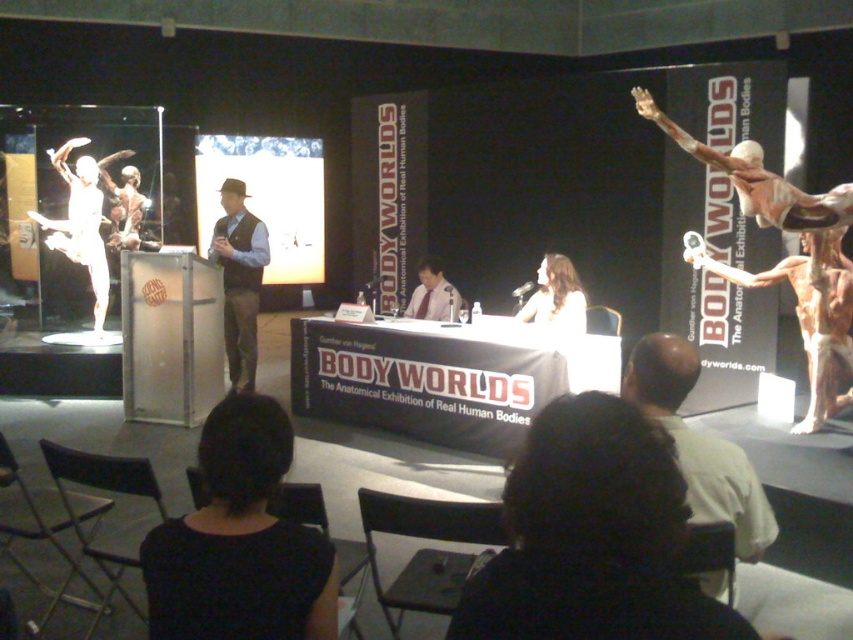
Does black fabric at lower center have a lesser width compared to matte brown vest at center?

Yes.

Who is higher up, black fabric at lower center or matte brown vest at center?

matte brown vest at center

Where is `black fabric at lower center`? The width and height of the screenshot is (853, 640). black fabric at lower center is located at coordinates (241, 541).

Between dark brown hair at lower center and pink fabric tie at center, which one is positioned higher?

pink fabric tie at center is above.

Does dark brown hair at lower center lie behind pink fabric tie at center?

No.

Image resolution: width=853 pixels, height=640 pixels. Find the location of `dark brown hair at lower center`. dark brown hair at lower center is located at coordinates (592, 536).

Where is `dark brown hair at lower center`? This screenshot has width=853, height=640. dark brown hair at lower center is located at coordinates (592, 536).

Looking at this image, how much distance is there between black fabric at lower center and pink fabric tie at center?

The distance of black fabric at lower center from pink fabric tie at center is 14.12 feet.

Can you confirm if black fabric at lower center is positioned to the left of pink fabric tie at center?

Correct, you'll find black fabric at lower center to the left of pink fabric tie at center.

Measure the distance between point (225, 637) and camera.

Point (225, 637) is 4.45 feet away from camera.

Image resolution: width=853 pixels, height=640 pixels. In order to click on black fabric at lower center in this screenshot , I will do `click(241, 541)`.